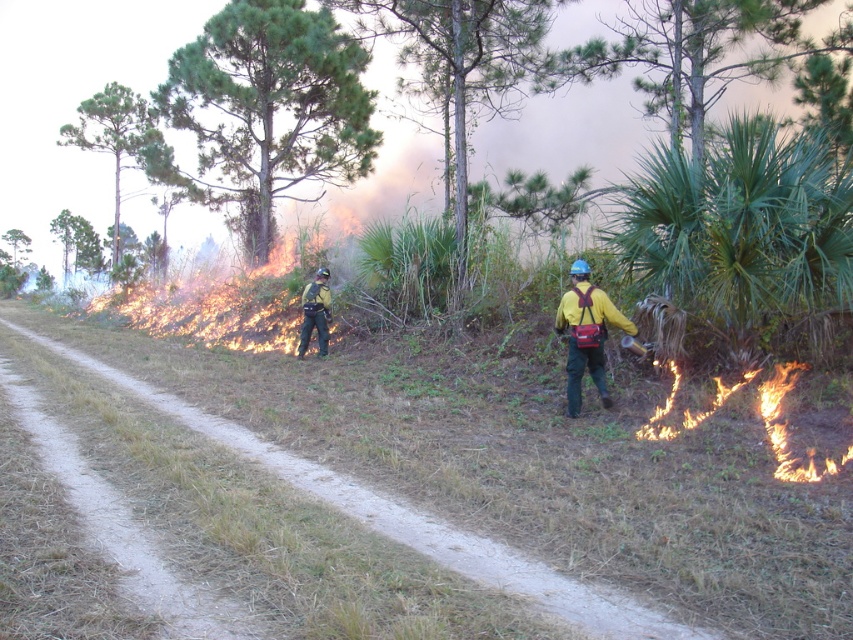
Who is positioned more to the left, brown dirt path at center or yellow matte jacket at right?

Positioned to the left is brown dirt path at center.

Does brown dirt path at center have a greater width compared to yellow matte jacket at right?

Yes.

Between point (134, 390) and point (561, 332), which one is positioned in front?

Point (561, 332) is in front.

Identify the location of brown dirt path at center. (407, 520).

In the scene shown: Can you confirm if brown dirt path at center is positioned below matte black uniform at center?

Yes.

Is brown dirt path at center to the left of matte black uniform at center from the viewer's perspective?

Correct, you'll find brown dirt path at center to the left of matte black uniform at center.

This screenshot has height=640, width=853. What do you see at coordinates (407, 520) in the screenshot?
I see `brown dirt path at center` at bounding box center [407, 520].

Locate an element on the screen. Image resolution: width=853 pixels, height=640 pixels. brown dirt path at center is located at coordinates (407, 520).

Does yellow matte jacket at right have a larger size compared to matte black uniform at center?

Indeed, yellow matte jacket at right has a larger size compared to matte black uniform at center.

Does yellow matte jacket at right appear over matte black uniform at center?

Actually, yellow matte jacket at right is below matte black uniform at center.

Between point (590, 336) and point (299, 348), which one is positioned in front?

Point (590, 336) is more forward.

Locate an element on the screen. This screenshot has width=853, height=640. yellow matte jacket at right is located at coordinates (585, 333).